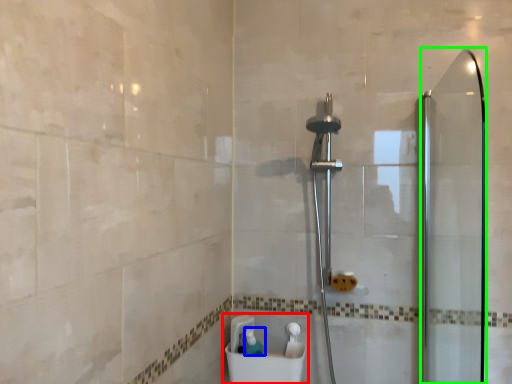
Question: Which object is positioned farthest from sink (highlighted by a red box)? Select from toiletry (highlighted by a blue box) and screen door (highlighted by a green box).

Choices:
 (A) toiletry
 (B) screen door

Answer: (B)